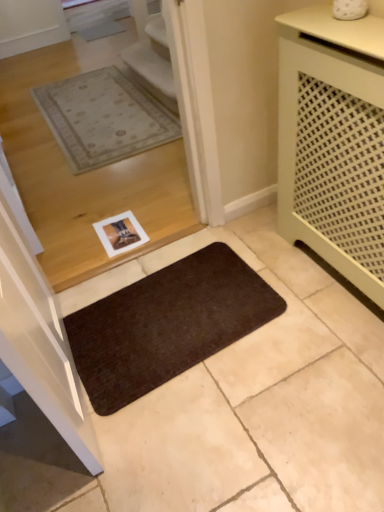
I want to click on free space in front of matte green cabinet at right, so click(321, 358).